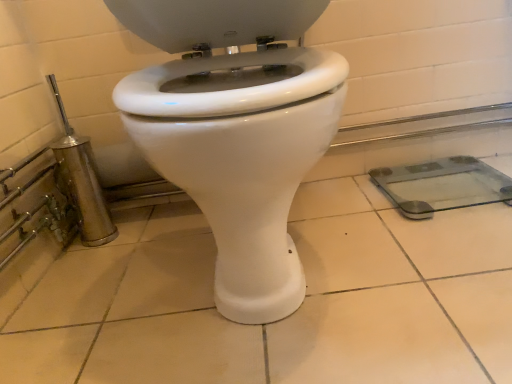
Image resolution: width=512 pixels, height=384 pixels. I want to click on vacant space underneath transparent glass scale at right (from a real-world perspective), so point(445,190).